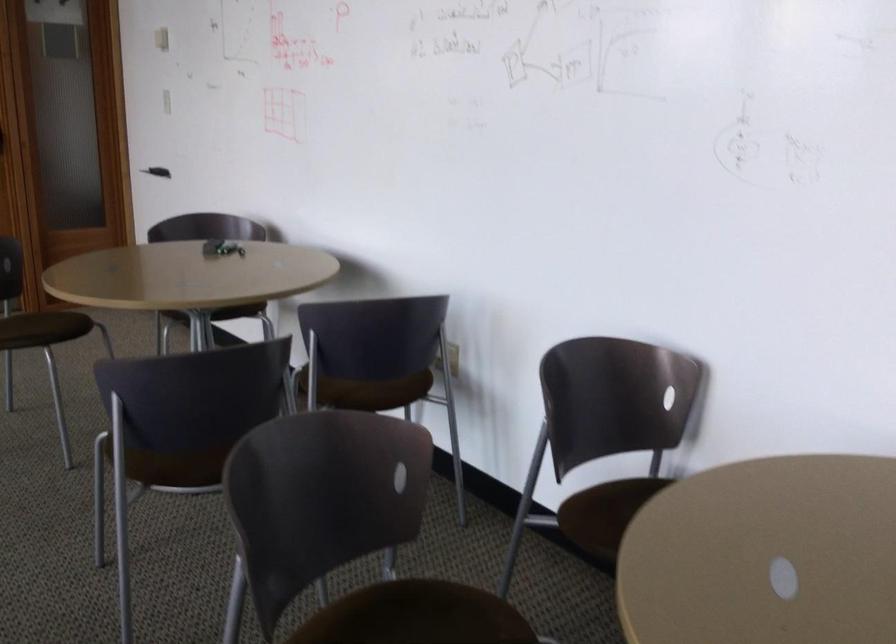
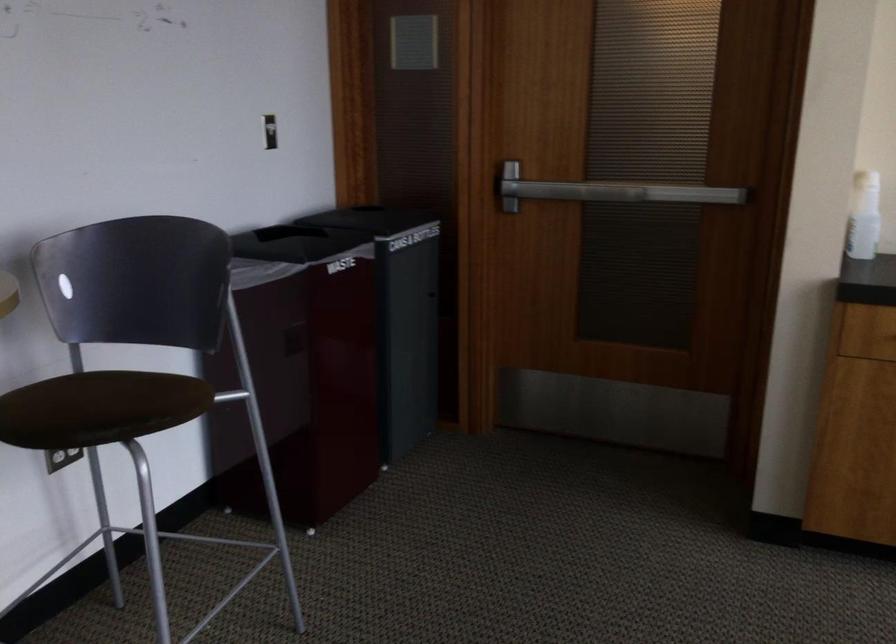
In the scene shown: The first image is from the beginning of the video and the second image is from the end. How did the camera likely rotate when shooting the video?

The camera rotated toward right-down.